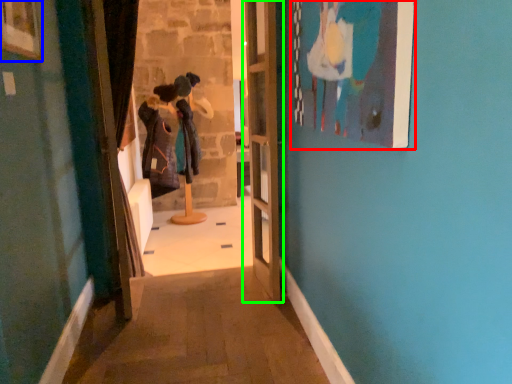
Question: Which object is the farthest from picture frame (highlighted by a red box)? Choose among these: picture frame (highlighted by a blue box) or door (highlighted by a green box).

Choices:
 (A) picture frame
 (B) door

Answer: (A)